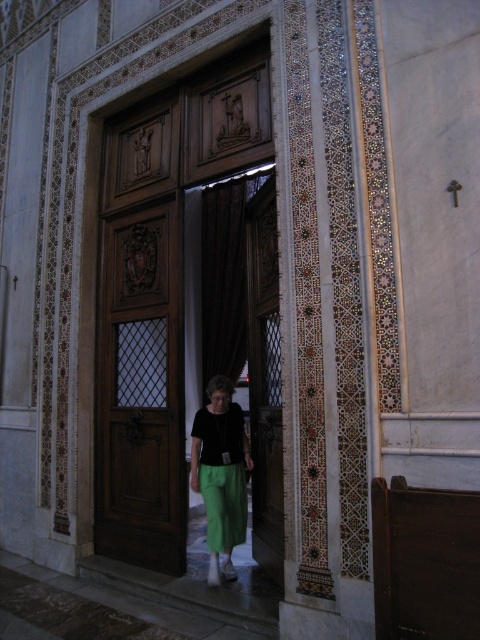
In the scene shown: You are an interior designer planning to place a 1.8m tall decorative statue in this space. Given the presence of the wooden at center and the green fabric skirt at center, which object should the statue be placed next to to ensure it doesn

The wooden at center is taller than the green fabric skirt at center. Therefore, placing the statue next to the wooden at center would provide a better proportional balance due to their similar heights.

You are an architect examining the interior of a religious building. You notice the polished wood door at center and the wooden at center. Which object is positioned lower in the scene?

The polished wood door at center is positioned lower than the wooden at center.

You are a painter standing in the church scene. You need to move a 16 inch wide painting frame from the wooden at center to the green fabric skirt at center. Can you fit the frame between them without moving either object?

The wooden at center and green fabric skirt at center are 17.35 inches apart. Since the painting frame is 16 inches wide, it can fit between them as the distance is greater than the frame width.